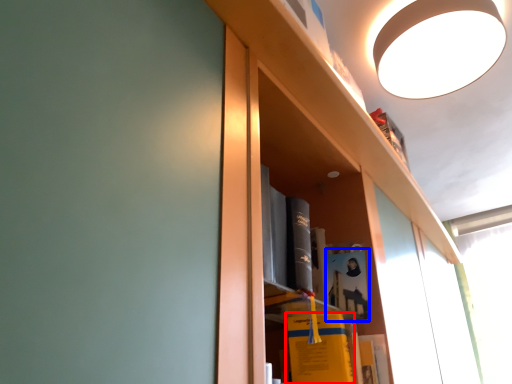
Question: Which point is further to the camera, book (highlighted by a red box) or book (highlighted by a blue box)?

Choices:
 (A) book
 (B) book

Answer: (B)